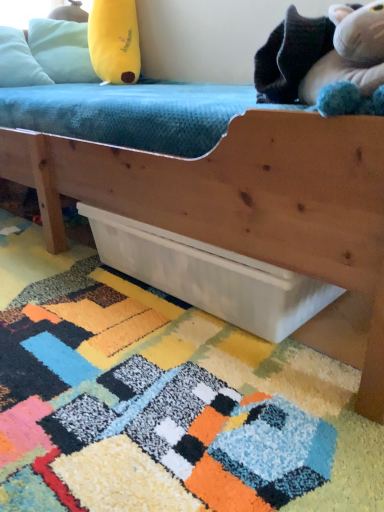
This screenshot has width=384, height=512. I want to click on fluffy white stuffed animal at upper right, which appears as the second toy when viewed from the left, so click(x=349, y=53).

The height and width of the screenshot is (512, 384). What do you see at coordinates (210, 276) in the screenshot?
I see `white matte drawer at lower center` at bounding box center [210, 276].

What is the approximate width of white matte drawer at lower center?

white matte drawer at lower center is 12.74 inches in width.

What do you see at coordinates (114, 41) in the screenshot? This screenshot has width=384, height=512. I see `yellow plush toy at upper left, the first toy viewed from the left` at bounding box center [114, 41].

Where is `fluffy white stuffed animal at upper right, which is the 1th toy from bottom to top`? fluffy white stuffed animal at upper right, which is the 1th toy from bottom to top is located at coordinates (349, 53).

Would you say white matte drawer at lower center is a long distance from yellow plush toy at upper left, acting as the 2th toy starting from the right?

Absolutely, white matte drawer at lower center is distant from yellow plush toy at upper left, acting as the 2th toy starting from the right.

Does point (187, 292) appear closer or farther from the camera than point (104, 14)?

Point (187, 292).

Considering the sizes of objects white matte drawer at lower center and yellow plush toy at upper left, the first toy viewed from the left, in the image provided, who is taller, white matte drawer at lower center or yellow plush toy at upper left, the first toy viewed from the left,?

Standing taller between the two is yellow plush toy at upper left, the first toy viewed from the left.

Which object is closer to the camera, white matte drawer at lower center or yellow plush toy at upper left, the second toy from the bottom?

white matte drawer at lower center is more forward.

Can you confirm if light blue fabric pillow at upper left is positioned to the right of multicolored shaggy rug at lower center?

Incorrect, light blue fabric pillow at upper left is not on the right side of multicolored shaggy rug at lower center.

Can you confirm if light blue fabric pillow at upper left is shorter than multicolored shaggy rug at lower center?

Incorrect, the height of light blue fabric pillow at upper left does not fall short of that of multicolored shaggy rug at lower center.

At what (x,y) coordinates should I click in order to perform the action: click on toy that is the 1st one when counting rightward from the multicolored shaggy rug at lower center. Please return your answer as a coordinate pair (x, y). This screenshot has width=384, height=512. Looking at the image, I should click on (114, 41).

Is there a large distance between yellow plush toy at upper left, the 1th toy viewed from the top, and multicolored shaggy rug at lower center?

Yes, yellow plush toy at upper left, the 1th toy viewed from the top, is far from multicolored shaggy rug at lower center.

Is yellow plush toy at upper left, acting as the 2th toy starting from the right, inside or outside of multicolored shaggy rug at lower center?

yellow plush toy at upper left, acting as the 2th toy starting from the right, is not enclosed by multicolored shaggy rug at lower center.

In terms of width, does fluffy white stuffed animal at upper right, which is the 1th toy from bottom to top, look wider or thinner when compared to white matte drawer at lower center?

fluffy white stuffed animal at upper right, which is the 1th toy from bottom to top, is thinner than white matte drawer at lower center.

Does fluffy white stuffed animal at upper right, which is the second toy from back to front, come in front of white matte drawer at lower center?

Yes, fluffy white stuffed animal at upper right, which is the second toy from back to front, is closer to the viewer.

In the scene shown: Could you tell me if fluffy white stuffed animal at upper right, which is the second toy from back to front, is turned towards white matte drawer at lower center?

No, fluffy white stuffed animal at upper right, which is the second toy from back to front, does not turn towards white matte drawer at lower center.

How distant is fluffy white stuffed animal at upper right, which appears as the 2th toy when viewed from the top, from white matte drawer at lower center?

fluffy white stuffed animal at upper right, which appears as the 2th toy when viewed from the top, is 17.14 inches away from white matte drawer at lower center.

Looking at this image, which point is more distant from viewer, (131, 37) or (358, 55)?

Point (131, 37)

Does yellow plush toy at upper left, positioned as the 1th toy in back-to-front order, appear on the right side of fluffy white stuffed animal at upper right, which appears as the 2th toy when viewed from the top?

No, yellow plush toy at upper left, positioned as the 1th toy in back-to-front order, is not to the right of fluffy white stuffed animal at upper right, which appears as the 2th toy when viewed from the top.

Who is bigger, yellow plush toy at upper left, positioned as the 2th toy in front-to-back order, or fluffy white stuffed animal at upper right, arranged as the first toy when viewed from the right?

yellow plush toy at upper left, positioned as the 2th toy in front-to-back order.

Identify the location of toy below the yellow plush toy at upper left, the first toy viewed from the left (from a real-world perspective). Image resolution: width=384 pixels, height=512 pixels. click(x=349, y=53).

From the picture: Is white matte drawer at lower center taller than light blue fabric pillow at upper left?

Incorrect, the height of white matte drawer at lower center is not larger of that of light blue fabric pillow at upper left.

Considering the relative sizes of white matte drawer at lower center and light blue fabric pillow at upper left in the image provided, is white matte drawer at lower center smaller than light blue fabric pillow at upper left?

Actually, white matte drawer at lower center might be larger than light blue fabric pillow at upper left.

Is white matte drawer at lower center in front of or behind light blue fabric pillow at upper left in the image?

In the image, white matte drawer at lower center appears in front of light blue fabric pillow at upper left.

Are white matte drawer at lower center and light blue fabric pillow at upper left located far from each other?

That's right, there is a large distance between white matte drawer at lower center and light blue fabric pillow at upper left.

The width and height of the screenshot is (384, 512). Find the location of `the 2nd toy directly beneath the light blue fabric pillow at upper left (from a real-world perspective)`. the 2nd toy directly beneath the light blue fabric pillow at upper left (from a real-world perspective) is located at coordinates (349, 53).

Which of these two, light blue fabric pillow at upper left or fluffy white stuffed animal at upper right, which is the second toy from back to front, stands taller?

light blue fabric pillow at upper left is taller.

Does light blue fabric pillow at upper left appear on the left side of fluffy white stuffed animal at upper right, which is the 1th toy from bottom to top?

Correct, you'll find light blue fabric pillow at upper left to the left of fluffy white stuffed animal at upper right, which is the 1th toy from bottom to top.

Considering the sizes of objects light blue fabric pillow at upper left and fluffy white stuffed animal at upper right, arranged as the 1th toy when viewed from the front, in the image provided, who is bigger, light blue fabric pillow at upper left or fluffy white stuffed animal at upper right, arranged as the 1th toy when viewed from the front,?

With larger size is light blue fabric pillow at upper left.

At what (x,y) coordinates should I click in order to perform the action: click on the 2nd toy above the white matte drawer at lower center (from the image's perspective). Please return your answer as a coordinate pair (x, y). Image resolution: width=384 pixels, height=512 pixels. Looking at the image, I should click on (114, 41).

At what (x,y) coordinates should I click in order to perform the action: click on mat located on the right of light blue fabric pillow at upper left. Please return your answer as a coordinate pair (x, y). This screenshot has height=512, width=384. Looking at the image, I should click on (161, 400).

When comparing their distances from light blue fabric pillow at upper left, does yellow plush toy at upper left, positioned as the 1th toy in back-to-front order, or white matte drawer at lower center seem further?

Based on the image, white matte drawer at lower center appears to be further to light blue fabric pillow at upper left.

When comparing their distances from light blue fabric pillow at upper left, does multicolored shaggy rug at lower center or fluffy white stuffed animal at upper right, which appears as the 2th toy when viewed from the top, seem closer?

The object closer to light blue fabric pillow at upper left is multicolored shaggy rug at lower center.

Considering their positions, is white matte drawer at lower center positioned closer to fluffy white stuffed animal at upper right, which is the 1th toy from bottom to top, than yellow plush toy at upper left, the first toy viewed from the left?

white matte drawer at lower center is closer to fluffy white stuffed animal at upper right, which is the 1th toy from bottom to top.

When comparing their distances from light blue fabric pillow at upper left, does fluffy white stuffed animal at upper right, which is the second toy from back to front, or yellow plush toy at upper left, the first toy viewed from the left, seem further?

fluffy white stuffed animal at upper right, which is the second toy from back to front, is positioned further to the anchor light blue fabric pillow at upper left.

Which object lies nearer to the anchor point light blue fabric pillow at upper left, white matte drawer at lower center or multicolored shaggy rug at lower center?

white matte drawer at lower center.

Considering their positions, is multicolored shaggy rug at lower center positioned further to white matte drawer at lower center than yellow plush toy at upper left, acting as the 2th toy starting from the right?

yellow plush toy at upper left, acting as the 2th toy starting from the right, is positioned further to the anchor white matte drawer at lower center.

Looking at the image, which one is located closer to fluffy white stuffed animal at upper right, arranged as the 1th toy when viewed from the front, multicolored shaggy rug at lower center or white matte drawer at lower center?

white matte drawer at lower center is positioned closer to the anchor fluffy white stuffed animal at upper right, arranged as the 1th toy when viewed from the front.

Considering their positions, is fluffy white stuffed animal at upper right, arranged as the 1th toy when viewed from the front, positioned closer to multicolored shaggy rug at lower center than yellow plush toy at upper left, positioned as the 2th toy in front-to-back order?

The object closer to multicolored shaggy rug at lower center is fluffy white stuffed animal at upper right, arranged as the 1th toy when viewed from the front.

Find the location of a particular element. This screenshot has width=384, height=512. drawer located between fluffy white stuffed animal at upper right, arranged as the 1th toy when viewed from the front, and yellow plush toy at upper left, the second toy from the bottom, in the depth direction is located at coordinates (210, 276).

You are a GUI agent. You are given a task and a screenshot of the screen. Output one action in this format:
    pyautogui.click(x=<x>, y=<y>)
    Task: Click on the pillow between fluffy white stuffed animal at upper right, arranged as the first toy when viewed from the right, and yellow plush toy at upper left, the first toy viewed from the left, from front to back
    Image resolution: width=384 pixels, height=512 pixels.
    Given the screenshot: What is the action you would take?
    pyautogui.click(x=19, y=61)

The width and height of the screenshot is (384, 512). Find the location of `drawer located between multicolored shaggy rug at lower center and fluffy white stuffed animal at upper right, which appears as the 2th toy when viewed from the top, in the left-right direction`. drawer located between multicolored shaggy rug at lower center and fluffy white stuffed animal at upper right, which appears as the 2th toy when viewed from the top, in the left-right direction is located at coordinates (210, 276).

Identify the location of drawer positioned between fluffy white stuffed animal at upper right, which is the second toy from back to front, and light blue fabric pillow at upper left from near to far. (210, 276).